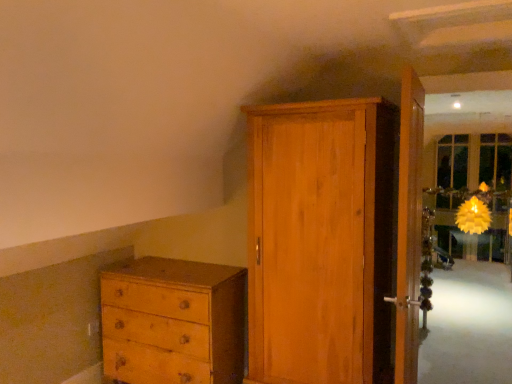
What do you see at coordinates (321, 241) in the screenshot?
I see `wooden wardrobe at center, the 1th door viewed from the left` at bounding box center [321, 241].

I want to click on light brown wood chest of drawers at lower left, so click(173, 322).

From the image's perspective, which object appears higher, wooden door at right, acting as the 2th door starting from the left, or wooden wardrobe at center, the second door viewed from the right?

wooden door at right, acting as the 2th door starting from the left, is shown above in the image.

Can wooden wardrobe at center, the second door viewed from the right, be found inside wooden door at right, which is counted as the first door, starting from the right?

No, wooden wardrobe at center, the second door viewed from the right, is not inside wooden door at right, which is counted as the first door, starting from the right.

This screenshot has width=512, height=384. I want to click on door on the right side of wooden wardrobe at center, the 1th door viewed from the left, so click(409, 228).

Measure the distance between wooden door at right, acting as the 2th door starting from the left, and wooden wardrobe at center, the second door viewed from the right.

13.04 inches.

Does light brown wood chest of drawers at lower left turn towards wooden door at right, acting as the 2th door starting from the left?

No, light brown wood chest of drawers at lower left does not turn towards wooden door at right, acting as the 2th door starting from the left.

Can you tell me how much light brown wood chest of drawers at lower left and wooden door at right, acting as the 2th door starting from the left, differ in facing direction?

light brown wood chest of drawers at lower left and wooden door at right, acting as the 2th door starting from the left, are facing 91.3 degrees away from each other.

Considering the sizes of light brown wood chest of drawers at lower left and wooden door at right, acting as the 2th door starting from the left, in the image, is light brown wood chest of drawers at lower left wider or thinner than wooden door at right, acting as the 2th door starting from the left,?

light brown wood chest of drawers at lower left is wider than wooden door at right, acting as the 2th door starting from the left.

From the image's perspective, does light brown wood chest of drawers at lower left appear lower than wooden door at right, which is counted as the first door, starting from the right?

Indeed, from the image's perspective, light brown wood chest of drawers at lower left is shown beneath wooden door at right, which is counted as the first door, starting from the right.

Image resolution: width=512 pixels, height=384 pixels. I want to click on door behind the wooden door at right, acting as the 2th door starting from the left, so click(x=321, y=241).

From the image's perspective, who appears lower, wooden wardrobe at center, the second door viewed from the right, or wooden door at right, acting as the 2th door starting from the left?

wooden wardrobe at center, the second door viewed from the right.

Considering the sizes of objects wooden wardrobe at center, the second door viewed from the right, and wooden door at right, which is counted as the first door, starting from the right, in the image provided, who is smaller, wooden wardrobe at center, the second door viewed from the right, or wooden door at right, which is counted as the first door, starting from the right,?

With smaller size is wooden door at right, which is counted as the first door, starting from the right.

Which is more to the left, wooden wardrobe at center, the second door viewed from the right, or light brown wood chest of drawers at lower left?

Positioned to the left is light brown wood chest of drawers at lower left.

From the image's perspective, is wooden wardrobe at center, the second door viewed from the right, located beneath light brown wood chest of drawers at lower left?

Actually, wooden wardrobe at center, the second door viewed from the right, appears above light brown wood chest of drawers at lower left in the image.

How many degrees apart are the facing directions of wooden wardrobe at center, the second door viewed from the right, and light brown wood chest of drawers at lower left?

0.262 degrees.

Is point (362, 383) positioned after point (149, 331)?

No, it is in front of (149, 331).

Considering the positions of objects light brown wood chest of drawers at lower left and wooden wardrobe at center, the 1th door viewed from the left, in the image provided, who is more to the left, light brown wood chest of drawers at lower left or wooden wardrobe at center, the 1th door viewed from the left,?

Positioned to the left is light brown wood chest of drawers at lower left.

Is light brown wood chest of drawers at lower left facing towards wooden wardrobe at center, the 1th door viewed from the left?

No, light brown wood chest of drawers at lower left is not facing towards wooden wardrobe at center, the 1th door viewed from the left.

Looking at the image, does light brown wood chest of drawers at lower left seem bigger or smaller compared to wooden wardrobe at center, the 1th door viewed from the left?

In the image, light brown wood chest of drawers at lower left appears to be smaller than wooden wardrobe at center, the 1th door viewed from the left.

How distant is light brown wood chest of drawers at lower left from wooden wardrobe at center, the second door viewed from the right?

The distance of light brown wood chest of drawers at lower left from wooden wardrobe at center, the second door viewed from the right, is 27.19 inches.

Which object is closer to the camera, wooden door at right, which is counted as the first door, starting from the right, or light brown wood chest of drawers at lower left?

wooden door at right, which is counted as the first door, starting from the right, is more forward.

From the image's perspective, is wooden door at right, which is counted as the first door, starting from the right, below light brown wood chest of drawers at lower left?

No, from the image's perspective, wooden door at right, which is counted as the first door, starting from the right, is not beneath light brown wood chest of drawers at lower left.

Which is more distant, (403, 253) or (210, 349)?

Point (210, 349)

Could light brown wood chest of drawers at lower left be considered to be inside wooden door at right, which is counted as the first door, starting from the right?

Definitely not — light brown wood chest of drawers at lower left is not inside wooden door at right, which is counted as the first door, starting from the right.

Image resolution: width=512 pixels, height=384 pixels. What are the coordinates of `door above the wooden wardrobe at center, the second door viewed from the right (from the image's perspective)` in the screenshot? It's located at (409, 228).

Locate an element on the screen. Image resolution: width=512 pixels, height=384 pixels. the chest of drawers behind the wooden door at right, acting as the 2th door starting from the left is located at coordinates (173, 322).

Which object lies further to the anchor point light brown wood chest of drawers at lower left, wooden door at right, which is counted as the first door, starting from the right, or wooden wardrobe at center, the second door viewed from the right?

The object further to light brown wood chest of drawers at lower left is wooden door at right, which is counted as the first door, starting from the right.

Looking at the image, which one is located closer to wooden door at right, which is counted as the first door, starting from the right, wooden wardrobe at center, the 1th door viewed from the left, or light brown wood chest of drawers at lower left?

wooden wardrobe at center, the 1th door viewed from the left, lies closer to wooden door at right, which is counted as the first door, starting from the right, than the other object.

Considering their positions, is light brown wood chest of drawers at lower left positioned further to wooden wardrobe at center, the second door viewed from the right, than wooden door at right, acting as the 2th door starting from the left?

Based on the image, light brown wood chest of drawers at lower left appears to be further to wooden wardrobe at center, the second door viewed from the right.

Estimate the real-world distances between objects in this image. Which object is closer to wooden door at right, acting as the 2th door starting from the left, light brown wood chest of drawers at lower left or wooden wardrobe at center, the second door viewed from the right?

The object closer to wooden door at right, acting as the 2th door starting from the left, is wooden wardrobe at center, the second door viewed from the right.

Estimate the real-world distances between objects in this image. Which object is closer to wooden wardrobe at center, the second door viewed from the right, wooden door at right, acting as the 2th door starting from the left, or light brown wood chest of drawers at lower left?

wooden door at right, acting as the 2th door starting from the left, is positioned closer to the anchor wooden wardrobe at center, the second door viewed from the right.

When comparing their distances from light brown wood chest of drawers at lower left, does wooden wardrobe at center, the 1th door viewed from the left, or wooden door at right, acting as the 2th door starting from the left, seem further?

Based on the image, wooden door at right, acting as the 2th door starting from the left, appears to be further to light brown wood chest of drawers at lower left.

The image size is (512, 384). I want to click on door between light brown wood chest of drawers at lower left and wooden door at right, which is counted as the first door, starting from the right, in the horizontal direction, so click(x=321, y=241).